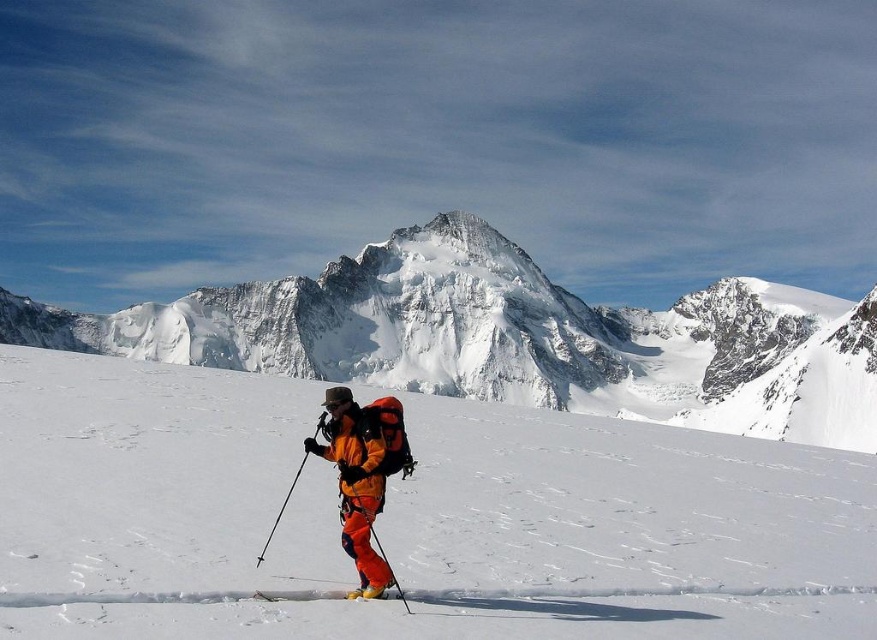
Question: Which of these objects is positioned farthest from the orange fabric ski slope at center?

Choices:
 (A) orange plastic ski pole at center
 (B) snowy granite peak at center
 (C) matte orange ski at center

Answer: (B)

Question: Which of the following is the closest to the observer?

Choices:
 (A) (380, 550)
 (B) (353, 483)
 (C) (814, 353)

Answer: (B)

Question: Which object is farther from the camera taking this photo?

Choices:
 (A) orange plastic ski pole at center
 (B) matte orange ski at center

Answer: (A)

Question: Does orange fabric ski slope at center have a greater width compared to orange fabric jacket at center?

Choices:
 (A) yes
 (B) no

Answer: (A)

Question: Is orange fabric jacket at center below matte orange ski at center?

Choices:
 (A) yes
 (B) no

Answer: (B)

Question: Can you confirm if snowy granite peak at center is positioned to the left of orange plastic ski pole at center?

Choices:
 (A) no
 (B) yes

Answer: (A)